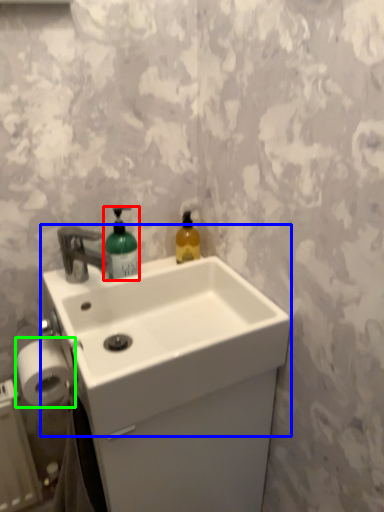
Question: Based on their relative distances, which object is farther from bottle (highlighted by a red box)? Choose from sink (highlighted by a blue box) and toilet paper (highlighted by a green box).

Choices:
 (A) sink
 (B) toilet paper

Answer: (B)